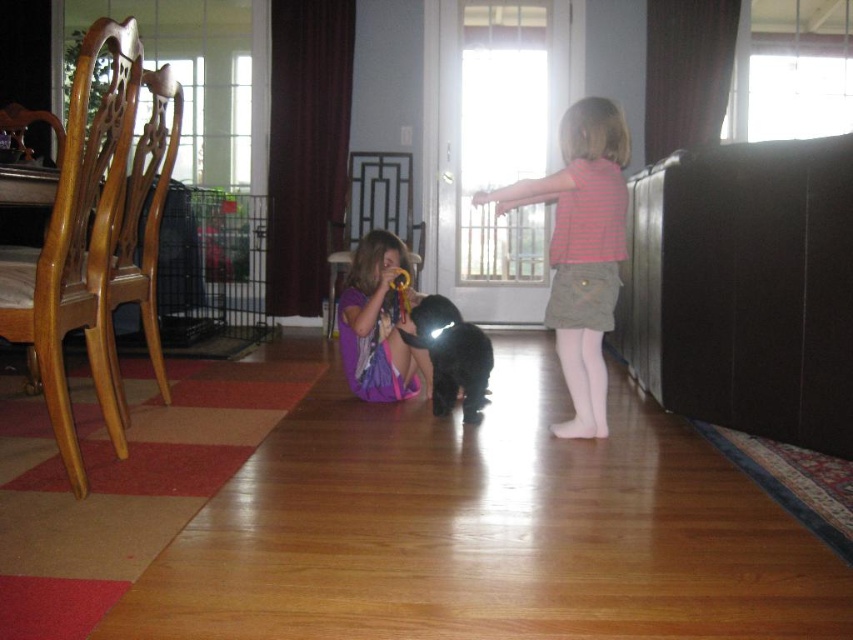
Is striped cotton shirt at center bigger than black fur dog at center?

Indeed, striped cotton shirt at center has a larger size compared to black fur dog at center.

Measure the distance between striped cotton shirt at center and camera.

They are 2.38 meters apart.

Where is `striped cotton shirt at center`? striped cotton shirt at center is located at coordinates (581, 250).

Does matte purple dress at center have a lesser width compared to black fur dog at center?

No.

In the scene shown: Who is more distant from viewer, (364, 326) or (438, 349)?

Positioned behind is point (364, 326).

You are a GUI agent. You are given a task and a screenshot of the screen. Output one action in this format:
    pyautogui.click(x=<x>, y=<y>)
    Task: Click on the matte purple dress at center
    The width and height of the screenshot is (853, 640).
    Given the screenshot: What is the action you would take?
    pyautogui.click(x=376, y=324)

Between point (614, 122) and point (403, 387), which one is positioned in front?

Point (614, 122) is in front.

This screenshot has height=640, width=853. Find the location of `striped cotton shirt at center`. striped cotton shirt at center is located at coordinates [581, 250].

In order to click on striped cotton shirt at center in this screenshot , I will do `click(581, 250)`.